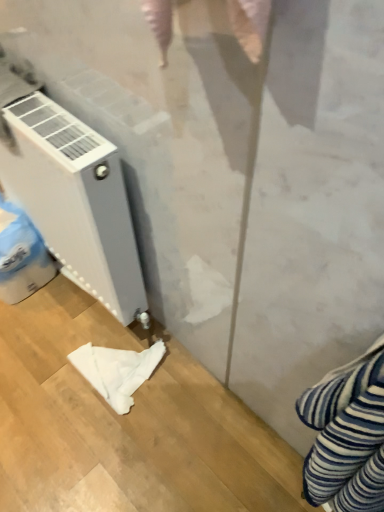
Question: Does point (72, 142) appear closer or farther from the camera than point (110, 375)?

Choices:
 (A) closer
 (B) farther

Answer: (A)

Question: Is white matte radiator at left bigger or smaller than white soft cloth at lower left?

Choices:
 (A) big
 (B) small

Answer: (A)

Question: Considering the positions of white matte radiator at left and white soft cloth at lower left in the image, is white matte radiator at left taller or shorter than white soft cloth at lower left?

Choices:
 (A) short
 (B) tall

Answer: (B)

Question: From a real-world perspective, is white soft cloth at lower left positioned above or below white matte radiator at left?

Choices:
 (A) above
 (B) below

Answer: (B)

Question: Is white soft cloth at lower left wider or thinner than white matte radiator at left?

Choices:
 (A) thin
 (B) wide

Answer: (B)

Question: Based on their sizes in the image, would you say white soft cloth at lower left is bigger or smaller than white matte radiator at left?

Choices:
 (A) big
 (B) small

Answer: (B)

Question: From the image's perspective, is white soft cloth at lower left located above or below white matte radiator at left?

Choices:
 (A) below
 (B) above

Answer: (A)